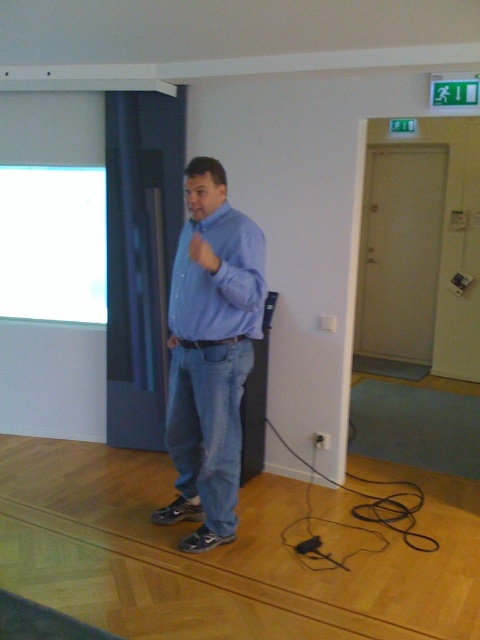
Is white glossy projection screen at upper left below blue cotton shirt at center?

Actually, white glossy projection screen at upper left is above blue cotton shirt at center.

Who is lower down, white glossy projection screen at upper left or blue cotton shirt at center?

blue cotton shirt at center is lower down.

Which is behind, point (37, 285) or point (237, 257)?

Point (37, 285)

Identify the location of white glossy projection screen at upper left. (52, 243).

Does point (227, 365) lie in front of point (173, 328)?

Yes, point (227, 365) is in front of point (173, 328).

Is blue denim jeans at center to the right of blue cotton shirt at center from the viewer's perspective?

No, blue denim jeans at center is not to the right of blue cotton shirt at center.

The height and width of the screenshot is (640, 480). What do you see at coordinates (211, 353) in the screenshot?
I see `blue denim jeans at center` at bounding box center [211, 353].

Locate an element on the screen. blue denim jeans at center is located at coordinates tap(211, 353).

Can you confirm if blue denim jeans at center is shorter than white glossy projection screen at upper left?

In fact, blue denim jeans at center may be taller than white glossy projection screen at upper left.

Is blue denim jeans at center positioned behind white glossy projection screen at upper left?

No, blue denim jeans at center is closer to the viewer.

The image size is (480, 640). Describe the element at coordinates (211, 353) in the screenshot. I see `blue denim jeans at center` at that location.

What are the coordinates of `blue denim jeans at center` in the screenshot? It's located at (211, 353).